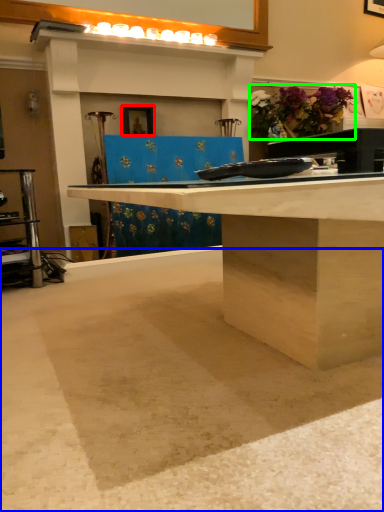
Question: Based on their relative distances, which object is nearer to picture frame (highlighted by a red box)? Choose from concrete (highlighted by a blue box) and flower (highlighted by a green box).

Choices:
 (A) concrete
 (B) flower

Answer: (B)